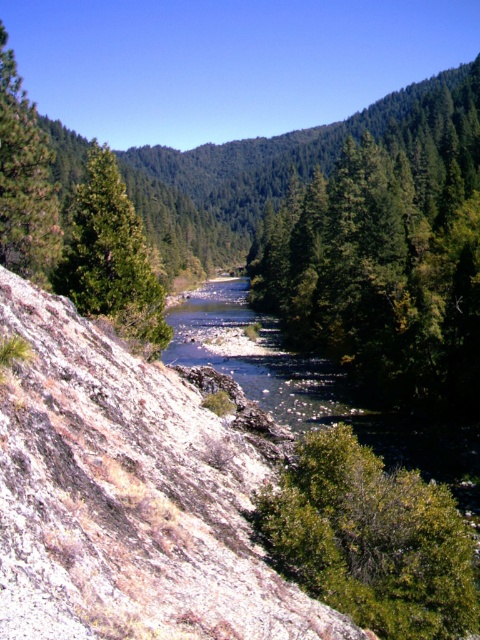
Question: Among these points, which one is farthest from the camera?

Choices:
 (A) (447, 532)
 (B) (84, 291)
 (C) (20, 131)
 (D) (80, 445)

Answer: (B)

Question: Can you confirm if rocky at center is thinner than green matte tree at upper left?

Choices:
 (A) no
 (B) yes

Answer: (B)

Question: Does green matte tree at center come behind green leafy tree at lower right?

Choices:
 (A) no
 (B) yes

Answer: (B)

Question: Does rocky at center come in front of green matte tree at upper left?

Choices:
 (A) yes
 (B) no

Answer: (A)

Question: Which of these objects is positioned farthest from the rocky at center?

Choices:
 (A) green matte tree at upper left
 (B) green leafy tree at lower right

Answer: (A)

Question: Which object is the closest to the rocky at center?

Choices:
 (A) green leafy tree at lower right
 (B) green matte tree at upper left
 (C) green matte tree at left

Answer: (A)